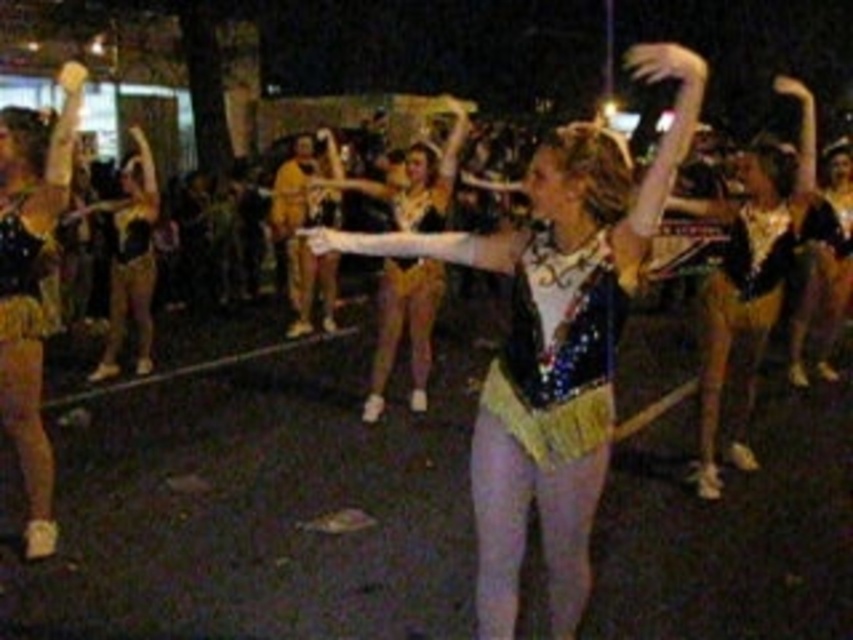
You are a photographer trying to capture a closeup of the shiny gold shorts at left and the sparkly sequined top at center. Which object would require a wider angle to fit entirely in the frame?

The shiny gold shorts at left would require a wider angle to fit entirely in the frame because its width surpasses that of the sparkly sequined top at center.

You are a photographer trying to capture a clear shot of both the sparkly sequined leotard at center and the shiny gold shorts at left. Since the lighting is low, you need to adjust your camera settings. Which object should you focus on first to ensure both are in the frame?

The sparkly sequined leotard at center is in front of the shiny gold shorts at left, so you should focus on the sparkly sequined leotard at center first to ensure both are in the frame.